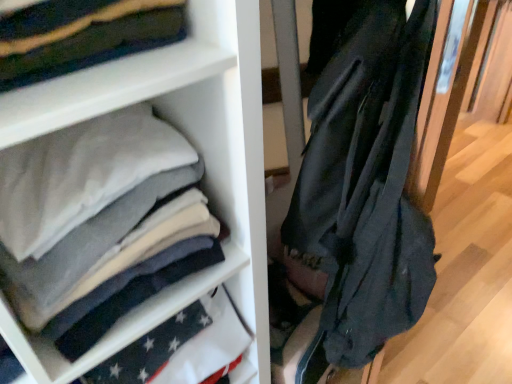
Question: From the image's perspective, is black matte jacket at right on top of white fabric at center?

Choices:
 (A) yes
 (B) no

Answer: (B)

Question: Is black matte jacket at right behind white fabric at center?

Choices:
 (A) yes
 (B) no

Answer: (B)

Question: Is black matte jacket at right aimed at white fabric at center?

Choices:
 (A) yes
 (B) no

Answer: (B)

Question: Is black matte jacket at right taller than white fabric at center?

Choices:
 (A) no
 (B) yes

Answer: (B)

Question: Is black matte jacket at right not inside white fabric at center?

Choices:
 (A) yes
 (B) no

Answer: (A)

Question: Is black matte jacket at right facing away from white fabric at center?

Choices:
 (A) yes
 (B) no

Answer: (B)

Question: Can you confirm if white fabric at center is positioned to the right of black matte jacket at right?

Choices:
 (A) yes
 (B) no

Answer: (B)

Question: Is white fabric at center bigger than black matte jacket at right?

Choices:
 (A) no
 (B) yes

Answer: (A)

Question: Can you confirm if white fabric at center is shorter than black matte jacket at right?

Choices:
 (A) no
 (B) yes

Answer: (B)

Question: From a real-world perspective, is white fabric at center positioned over black matte jacket at right based on gravity?

Choices:
 (A) no
 (B) yes

Answer: (B)

Question: Does white fabric at center have a smaller size compared to black matte jacket at right?

Choices:
 (A) no
 (B) yes

Answer: (B)

Question: From the image's perspective, is white fabric at center over black matte jacket at right?

Choices:
 (A) no
 (B) yes

Answer: (B)

Question: Considering the positions of white fabric at center and black matte jacket at right in the image, is white fabric at center bigger or smaller than black matte jacket at right?

Choices:
 (A) small
 (B) big

Answer: (A)